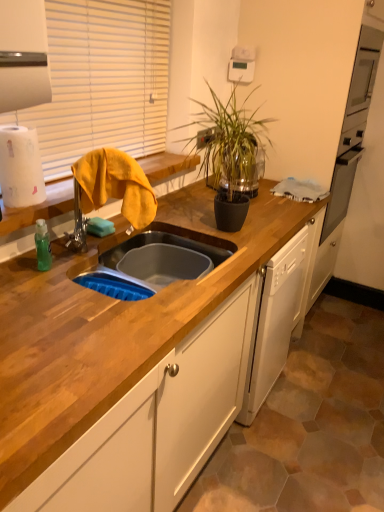
At what (x,y) coordinates should I click in order to perform the action: click on white matte paper towel at left. Please return your answer as a coordinate pair (x, y). This screenshot has height=512, width=384. Looking at the image, I should click on (20, 167).

What is the approximate height of white matte paper towel at left?

white matte paper towel at left is 9.62 inches tall.

Identify the location of yellow fabric at left. Image resolution: width=384 pixels, height=512 pixels. (102, 81).

Is green glossy plant at center touching yellow fabric at left?

green glossy plant at center is not next to yellow fabric at left, and they're not touching.

Which of these two, green glossy plant at center or yellow fabric at left, is smaller?

Smaller between the two is yellow fabric at left.

Is green glossy plant at center facing towards yellow fabric at left?

No.

What are the coordinates of `faucet in front of the green glossy plant at center` in the screenshot? It's located at (111, 189).

Does point (210, 411) lie behind point (155, 183)?

No, it is not.

Based on the photo, is wooden countertop at center bigger than wooden at left?

Indeed, wooden countertop at center has a larger size compared to wooden at left.

Considering the sizes of objects wooden countertop at center and wooden at left in the image provided, who is thinner, wooden countertop at center or wooden at left?

wooden at left.

Is wooden countertop at center directly adjacent to wooden at left?

No, wooden countertop at center is not with wooden at left.

Which of these two, green glossy plant at center or wooden countertop at center, stands shorter?

green glossy plant at center is shorter.

Considering the relative sizes of green glossy plant at center and wooden countertop at center in the image provided, is green glossy plant at center smaller than wooden countertop at center?

Correct, green glossy plant at center occupies less space than wooden countertop at center.

Would you say green glossy plant at center is outside wooden countertop at center?

Indeed, green glossy plant at center is completely outside wooden countertop at center.

Is yellow fabric at left facing away from wooden at left?

yellow fabric at left is not turned away from wooden at left.

Is yellow fabric at left spatially inside wooden at left, or outside of it?

yellow fabric at left is not enclosed by wooden at left.

Which is closer, (76, 234) or (171, 161)?

Clearly, point (76, 234) is closer to the camera than point (171, 161).

Between yellow fabric at left and wooden at left, which one appears on the right side from the viewer's perspective?

From the viewer's perspective, yellow fabric at left appears more on the right side.

Considering the positions of objects yellow fabric at left and yellow fabric at left in the image provided, who is more to the right, yellow fabric at left or yellow fabric at left?

From the viewer's perspective, yellow fabric at left appears more on the right side.

From the image's perspective, is yellow fabric at left positioned above or below yellow fabric at left?

yellow fabric at left is below yellow fabric at left.

Does point (131, 184) appear closer or farther from the camera than point (75, 111)?

Point (131, 184) is closer to the camera than point (75, 111).

Consider the image. Which of these two, yellow fabric at left or yellow fabric at left, stands shorter?

With less height is yellow fabric at left.

Is yellow fabric at left turned away from white matte paper towel at left?

That's not correct — yellow fabric at left is not looking away from white matte paper towel at left.

Identify the location of window screen located on the right of white matte paper towel at left. (102, 81).

Between yellow fabric at left and white matte paper towel at left, which one has larger size?

With larger size is yellow fabric at left.

Does yellow fabric at left come in front of white matte paper towel at left?

Yes, yellow fabric at left is in front of white matte paper towel at left.

From a real-world perspective, is green glossy plant at center beneath wooden at left?

No, from a real-world perspective, green glossy plant at center is not under wooden at left.

Does green glossy plant at center lie in front of wooden at left?

No, it is not.

Is green glossy plant at center next to wooden at left and touching it?

They are not placed beside each other.

You are a GUI agent. You are given a task and a screenshot of the screen. Output one action in this format:
    pyautogui.click(x=<x>, y=<y>)
    Task: Click on the houseplant above the yellow fabric at left (from the image's perspective)
    
    Given the screenshot: What is the action you would take?
    pyautogui.click(x=229, y=152)

At what (x,y) coordinates should I click in order to perform the action: click on countertop that appears above the wooden countertop at center (from a real-world perspective). Please return your answer as a coordinate pair (x, y). The image size is (384, 512). Looking at the image, I should click on (39, 208).

Considering their positions, is yellow fabric at left positioned closer to wooden at left than wooden countertop at center?

yellow fabric at left lies closer to wooden at left than the other object.

When comparing their distances from wooden countertop at center, does yellow fabric at left or wooden at left seem further?

Based on the image, wooden at left appears to be further to wooden countertop at center.

From the image, which object appears to be nearer to wooden at left, green glossy plant at center or yellow fabric at left?

yellow fabric at left.

When comparing their distances from yellow fabric at left, does wooden at left or yellow fabric at left seem closer?

Based on the image, wooden at left appears to be nearer to yellow fabric at left.

Considering their positions, is wooden at left positioned closer to yellow fabric at left than wooden countertop at center?

Among the two, wooden at left is located nearer to yellow fabric at left.

From the image, which object appears to be farther from white matte paper towel at left, yellow fabric at left or green glossy plant at center?

green glossy plant at center is positioned further to the anchor white matte paper towel at left.

Which object lies nearer to the anchor point green glossy plant at center, white matte paper towel at left or wooden countertop at center?

wooden countertop at center is closer to green glossy plant at center.

Estimate the real-world distances between objects in this image. Which object is further from green glossy plant at center, wooden countertop at center or wooden at left?

wooden countertop at center is further to green glossy plant at center.

I want to click on faucet located between white matte paper towel at left and green glossy plant at center in the left-right direction, so click(x=111, y=189).

Identify the location of countertop between white matte paper towel at left and green glossy plant at center in the horizontal direction. (39, 208).

Identify the location of faucet between yellow fabric at left and wooden countertop at center in the up-down direction. Image resolution: width=384 pixels, height=512 pixels. (111, 189).

Locate an element on the screen. This screenshot has height=512, width=384. countertop between yellow fabric at left and white matte paper towel at left in the up-down direction is located at coordinates pyautogui.click(x=39, y=208).